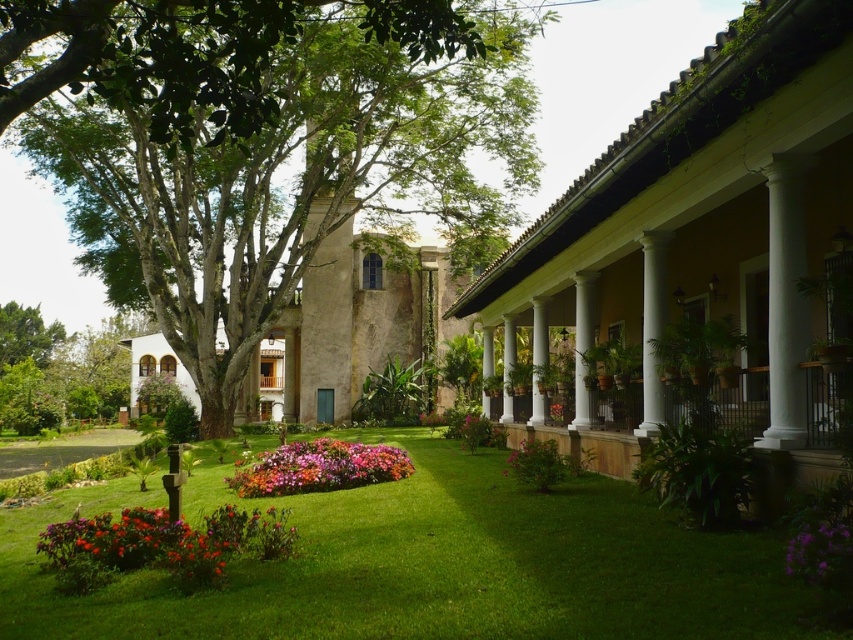
How far apart are purple matte flower at lower right and white glossy column at center?

The distance of purple matte flower at lower right from white glossy column at center is 9.04 meters.

Identify the location of purple matte flower at lower right. This screenshot has height=640, width=853. (820, 552).

I want to click on purple matte flower at lower right, so click(x=820, y=552).

Find the location of a particular element. purple matte flower at lower right is located at coordinates (820, 552).

Does vibrant floral bed at center appear on the right side of white smooth column at center?

In fact, vibrant floral bed at center is to the left of white smooth column at center.

Locate an element on the screen. vibrant floral bed at center is located at coordinates (318, 467).

This screenshot has height=640, width=853. What do you see at coordinates (318, 467) in the screenshot?
I see `vibrant floral bed at center` at bounding box center [318, 467].

In order to click on vibrant floral bed at center in this screenshot , I will do `click(318, 467)`.

Is white smooth column at right thinner than white smooth column at center?

No, white smooth column at right is not thinner than white smooth column at center.

Is point (796, 177) farther from camera compared to point (648, 356)?

That is False.

Where is `white smooth column at right`? The image size is (853, 640). white smooth column at right is located at coordinates (786, 301).